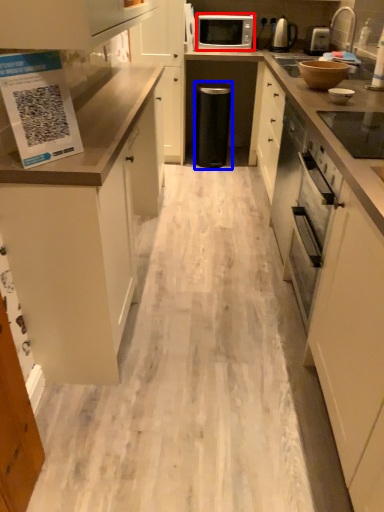
Question: Which object is further to the camera taking this photo, microwave oven (highlighted by a red box) or appliance (highlighted by a blue box)?

Choices:
 (A) microwave oven
 (B) appliance

Answer: (B)